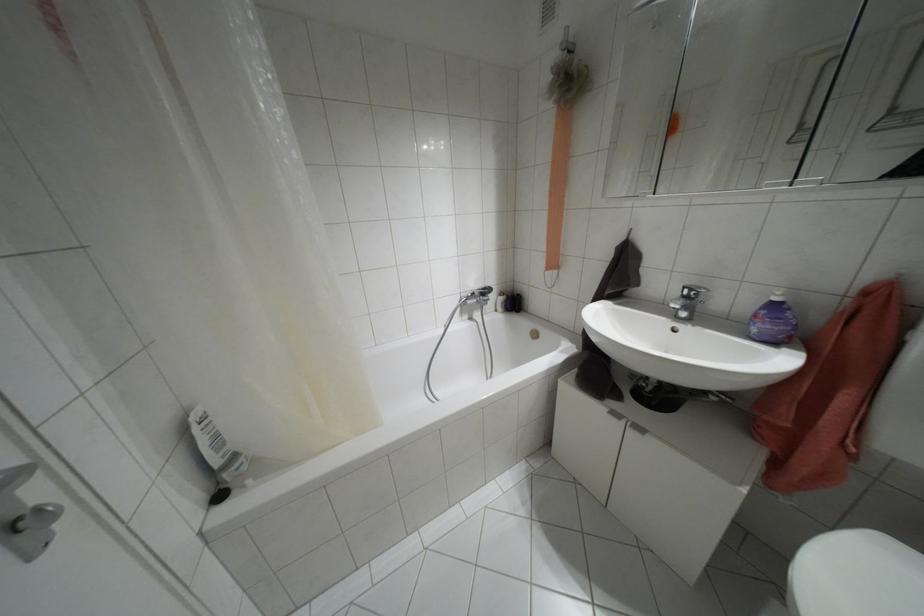
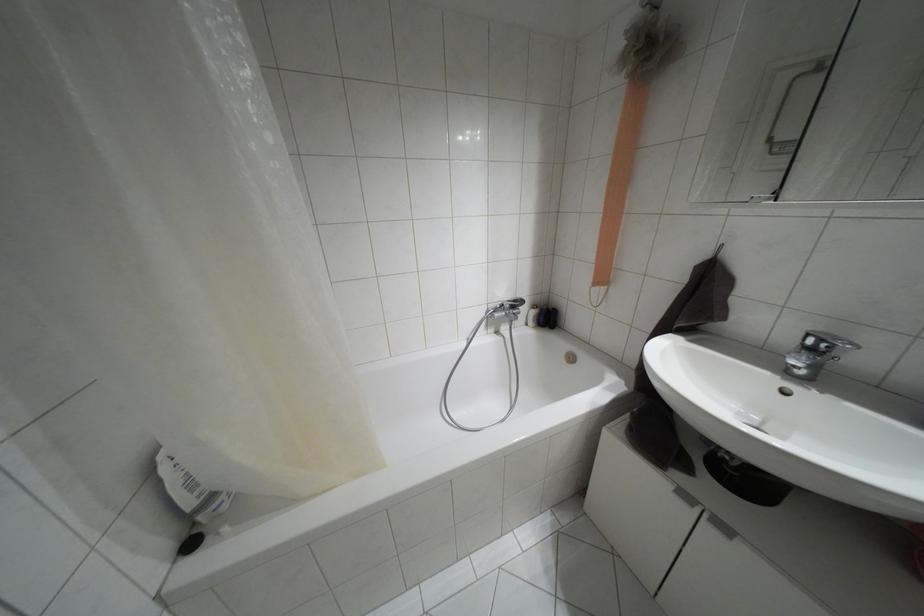
In the second image, find the point that corresponds to pixel 482 288 in the first image.

(514, 301)